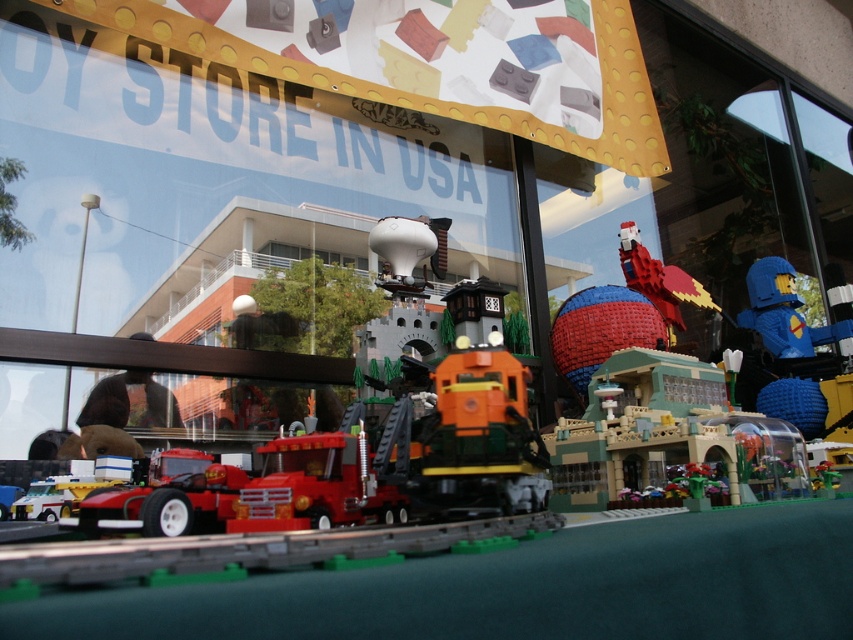
Question: Is matte red truck at center below brick red bird at upper right?

Choices:
 (A) yes
 (B) no

Answer: (A)

Question: Estimate the real-world distances between objects in this image. Which object is farther from the clear glass window at center?

Choices:
 (A) brick red bird at upper right
 (B) matte red truck at center

Answer: (B)

Question: Observing the image, what is the correct spatial positioning of matte red truck at center in reference to clear glass window at center?

Choices:
 (A) right
 (B) left

Answer: (A)

Question: Which object is farther from the camera taking this photo?

Choices:
 (A) clear glass window at center
 (B) brick red bird at upper right
 (C) matte red truck at center

Answer: (A)

Question: Which object appears closest to the camera in this image?

Choices:
 (A) matte red truck at center
 (B) brick red bird at upper right

Answer: (A)

Question: Can you confirm if brick red bird at upper right is bigger than clear glass window at center?

Choices:
 (A) no
 (B) yes

Answer: (B)